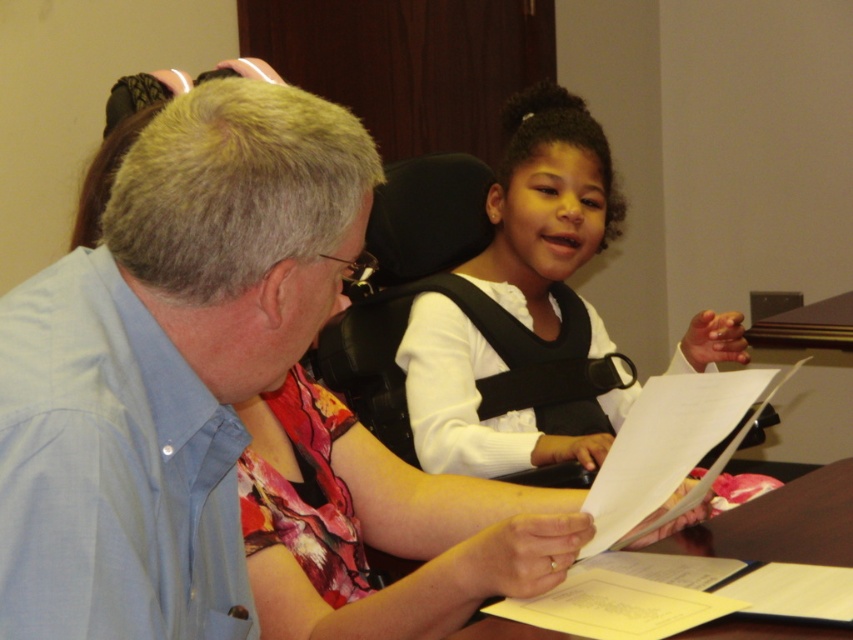
Question: Which of these objects is positioned closest to the white matte vest at center?

Choices:
 (A) brown wooden table at center
 (B) light blue shirt at left

Answer: (A)

Question: Does white matte vest at center have a larger size compared to brown wooden table at center?

Choices:
 (A) yes
 (B) no

Answer: (A)

Question: Which of the following is the farthest from the observer?

Choices:
 (A) (509, 129)
 (B) (22, 593)

Answer: (A)

Question: Does light blue shirt at left appear on the left side of white matte vest at center?

Choices:
 (A) yes
 (B) no

Answer: (A)

Question: Does light blue shirt at left have a smaller size compared to brown wooden table at center?

Choices:
 (A) yes
 (B) no

Answer: (A)

Question: Considering the real-world distances, which object is closest to the brown wooden table at center?

Choices:
 (A) light blue shirt at left
 (B) white matte vest at center

Answer: (A)